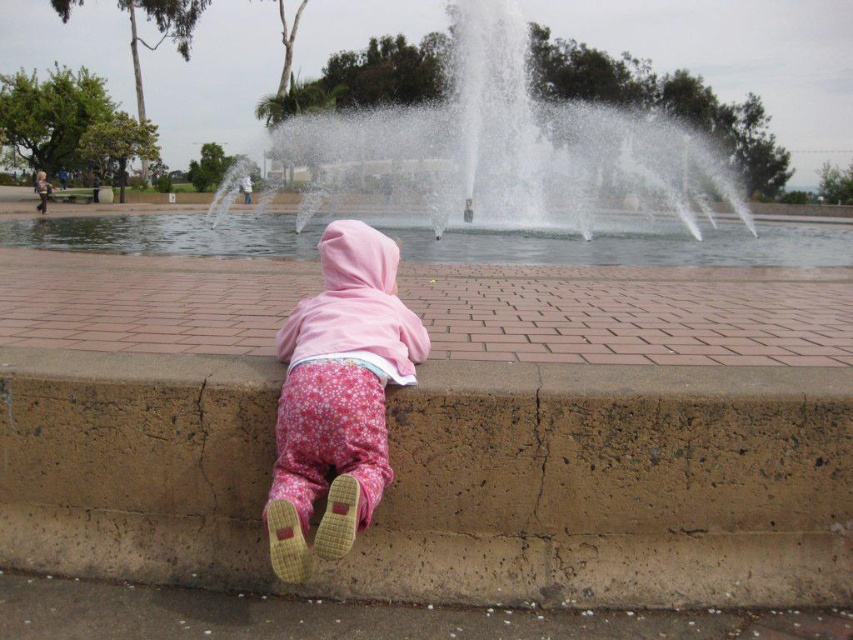
Which is behind, point (566, 164) or point (151, 236)?

The point (566, 164) is more distant.

Is white water at center shorter than clear water at center?

Incorrect, white water at center's height does not fall short of clear water at center's.

Who is more forward, (432,170) or (523,262)?

Point (523,262) is more forward.

The width and height of the screenshot is (853, 640). Find the location of `white water at center`. white water at center is located at coordinates (514, 140).

Is pink fleece jacket at center smaller than clear water at center?

Correct, pink fleece jacket at center occupies less space than clear water at center.

In the scene shown: Does pink fleece jacket at center appear over clear water at center?

No, pink fleece jacket at center is not above clear water at center.

Image resolution: width=853 pixels, height=640 pixels. What are the coordinates of `pink fleece jacket at center` in the screenshot? It's located at (338, 396).

Who is positioned more to the right, brown concrete curb at lower center or white water at center?

white water at center is more to the right.

Is brown concrete curb at lower center thinner than white water at center?

Yes, brown concrete curb at lower center is thinner than white water at center.

I want to click on brown concrete curb at lower center, so click(x=612, y=486).